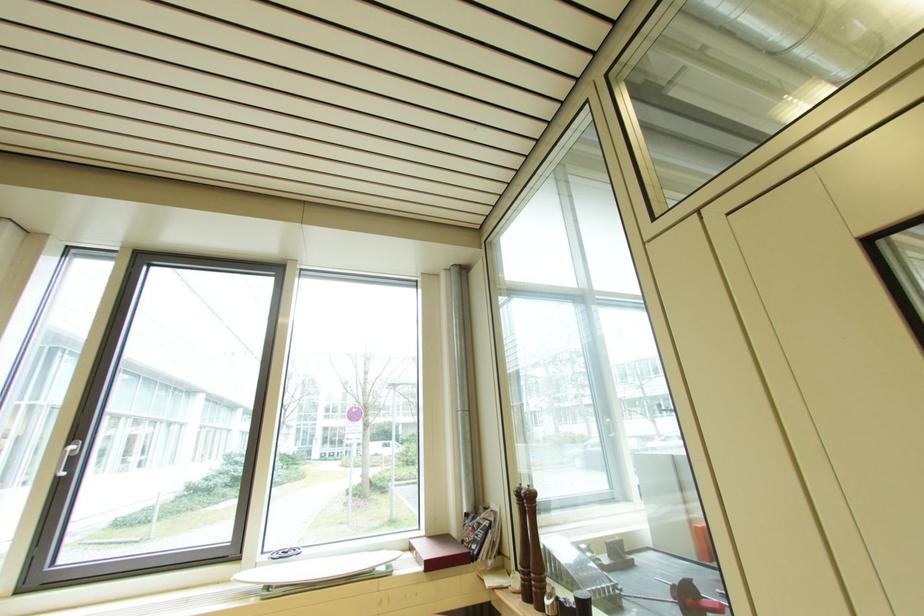
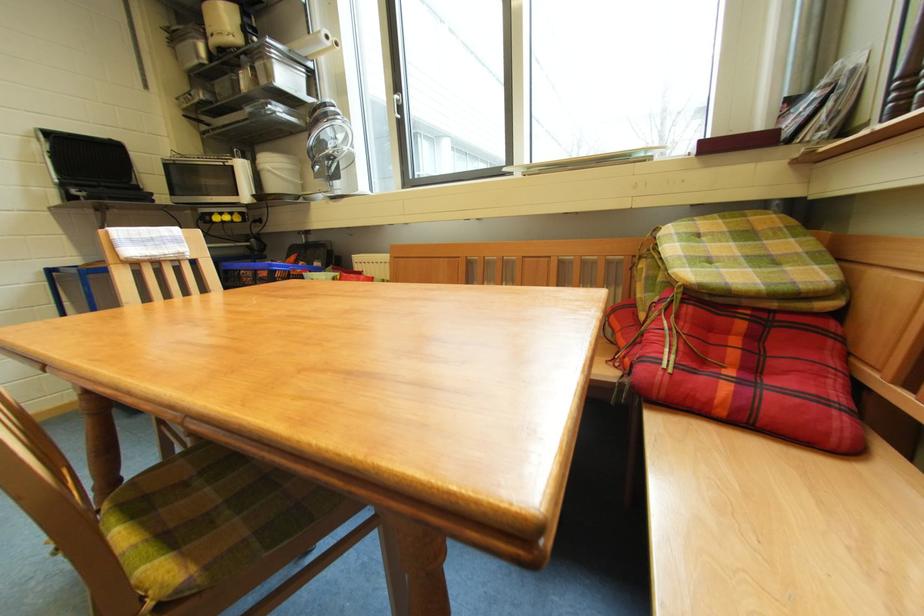
The images are taken continuously from a first-person perspective. In which direction is your viewpoint rotating?

The camera's rotation is toward left-down.